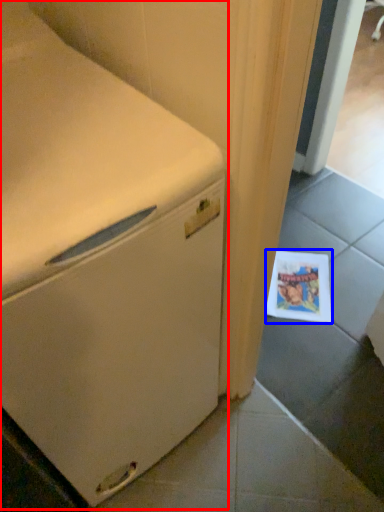
Question: Which of the following is the closest to the observer, home appliance (highlighted by a red box) or postcard (highlighted by a blue box)?

Choices:
 (A) home appliance
 (B) postcard

Answer: (A)